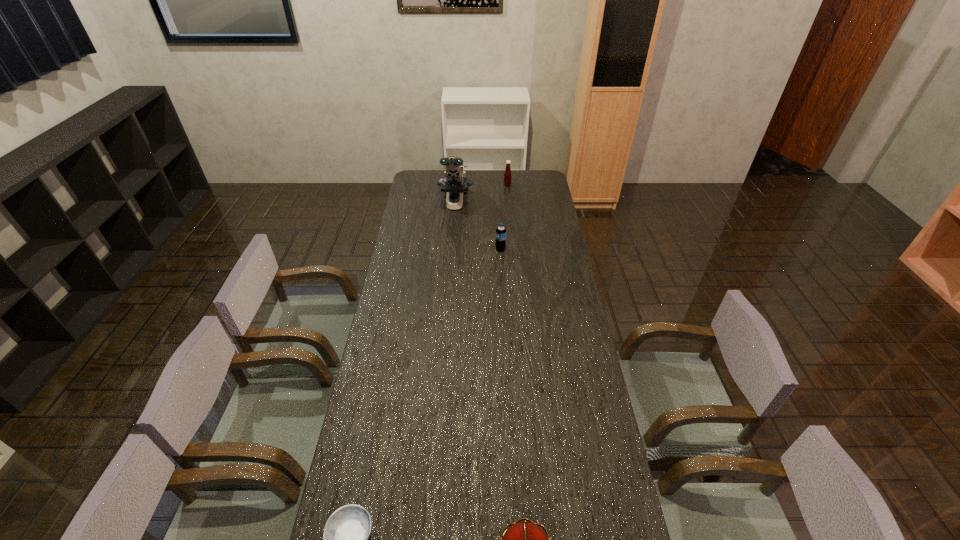
At what (x,y) coordinates should I click in order to perform the action: click on microscope. Please return your answer as a coordinate pair (x, y). Looking at the image, I should click on (455, 183).

Locate an element on the screen. the fourth nearest object is located at coordinates (455, 183).

Image resolution: width=960 pixels, height=540 pixels. I want to click on Tabasco sauce, so click(x=507, y=174).

The width and height of the screenshot is (960, 540). I want to click on the third farthest object, so click(500, 243).

Identify the location of free location located 0.200m through the eyepieces of the microscope. (452, 244).

This screenshot has height=540, width=960. Find the location of `free space located on the left of the Tabasco sauce`. free space located on the left of the Tabasco sauce is located at coordinates (484, 185).

Find the location of a particular element. Image resolution: width=960 pixels, height=540 pixels. free space located on the back of the third nearest object is located at coordinates (498, 203).

Where is `microscope located in the far edge section of the desktop`? The height and width of the screenshot is (540, 960). microscope located in the far edge section of the desktop is located at coordinates (455, 183).

This screenshot has width=960, height=540. Identify the location of Tabasco sauce at the far edge. (507, 174).

Find the location of `object that is at the left edge`. object that is at the left edge is located at coordinates (455, 183).